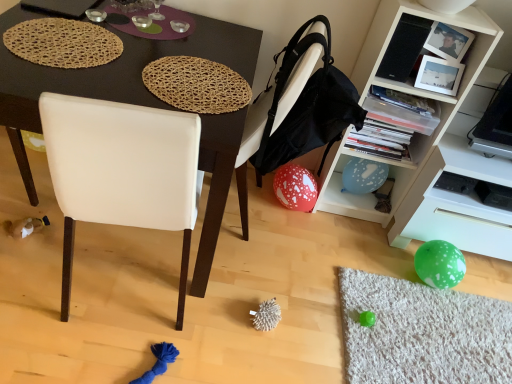
Identify the location of white matte cabinet at upper right. (408, 93).

This screenshot has width=512, height=384. What do you see at coordinates (456, 203) in the screenshot?
I see `white plastic shelf at lower right` at bounding box center [456, 203].

This screenshot has width=512, height=384. Identify the location of matte black desk at center. 110,73.

You are a GUI agent. You are given a task and a screenshot of the screen. Output one action in this format:
    pyautogui.click(x=<x>, y=<y>)
    Task: Click on the red dotted balloon at lower center
    This screenshot has height=384, width=512.
    Given the screenshot: What is the action you would take?
    pyautogui.click(x=295, y=187)

Locate an element on the screen. brown woven placemat at upper left, which appears as the 1th mat when viewed from the left is located at coordinates (63, 43).

The height and width of the screenshot is (384, 512). Describe the element at coordinates (270, 120) in the screenshot. I see `white leather chair at center` at that location.

Locate an element on the screen. white matte cabinet at upper right is located at coordinates (408, 93).

Is matte black desk at center beside white matte cabinet at upper right?

No, matte black desk at center is not beside white matte cabinet at upper right.

Does matte black desk at center turn towards white matte cabinet at upper right?

No, matte black desk at center is not oriented towards white matte cabinet at upper right.

Which object is positioned more to the left, matte black desk at center or white matte cabinet at upper right?

Positioned to the left is matte black desk at center.

What's the angular difference between matte black desk at center and white matte cabinet at upper right's facing directions?

matte black desk at center and white matte cabinet at upper right are facing 0.845 degrees away from each other.

Based on their sizes in the image, would you say matte black desk at center is bigger or smaller than brown woven placemat at upper left, which appears as the 1th mat when viewed from the left?

matte black desk at center is bigger than brown woven placemat at upper left, which appears as the 1th mat when viewed from the left.

From a real-world perspective, between matte black desk at center and brown woven placemat at upper left, arranged as the second mat when viewed from the right, who is vertically higher?

brown woven placemat at upper left, arranged as the second mat when viewed from the right, from a real-world perspective.

Which object is closer to the camera taking this photo, matte black desk at center or brown woven placemat at upper left, arranged as the second mat when viewed from the right?

matte black desk at center is more forward.

Would you say brown woven placemat at upper left, which appears as the 1th mat when viewed from the left, is part of matte black desk at center's contents?

Yes, matte black desk at center contains brown woven placemat at upper left, which appears as the 1th mat when viewed from the left.

In the image, is woven natural placemat at upper center, acting as the second mat starting from the left, positioned in front of or behind white plastic shelf at lower right?

woven natural placemat at upper center, acting as the second mat starting from the left, is positioned closer to the viewer than white plastic shelf at lower right.

Considering the sizes of objects woven natural placemat at upper center, acting as the second mat starting from the left, and white plastic shelf at lower right in the image provided, who is taller, woven natural placemat at upper center, acting as the second mat starting from the left, or white plastic shelf at lower right?

With more height is white plastic shelf at lower right.

Is woven natural placemat at upper center, acting as the second mat starting from the left, situated inside white plastic shelf at lower right or outside?

The correct answer is: outside.

At what (x,y) coordinates should I click in order to perform the action: click on the 1st mat above the white plastic shelf at lower right (from the image's perspective). Please return your answer as a coordinate pair (x, y). The height and width of the screenshot is (384, 512). Looking at the image, I should click on (196, 85).

Find the location of a particular element. The width and height of the screenshot is (512, 384). chair below the woven natural placemat at upper center, acting as the second mat starting from the left (from a real-world perspective) is located at coordinates (270, 120).

Is there a large distance between white leather chair at center and woven natural placemat at upper center, acting as the second mat starting from the left?

No, white leather chair at center is in close proximity to woven natural placemat at upper center, acting as the second mat starting from the left.

Is white leather chair at center situated inside woven natural placemat at upper center, acting as the second mat starting from the left, or outside?

white leather chair at center exists outside the volume of woven natural placemat at upper center, acting as the second mat starting from the left.

Which object is positioned more to the left, white leather chair at center or woven natural placemat at upper center, acting as the second mat starting from the left?

From the viewer's perspective, woven natural placemat at upper center, acting as the second mat starting from the left, appears more on the left side.

Does woven natural placemat at upper center, acting as the second mat starting from the left, have a greater width compared to white leather chair at center?

No, woven natural placemat at upper center, acting as the second mat starting from the left, is not wider than white leather chair at center.

Is woven natural placemat at upper center, the first mat when ordered from right to left, smaller than white leather chair at center?

Yes, woven natural placemat at upper center, the first mat when ordered from right to left, is smaller than white leather chair at center.

From a real-world perspective, is woven natural placemat at upper center, acting as the second mat starting from the left, below white leather chair at center?

Incorrect, from a real-world perspective, woven natural placemat at upper center, acting as the second mat starting from the left, is higher than white leather chair at center.

From their relative heights in the image, would you say brown woven placemat at upper left, arranged as the second mat when viewed from the right, is taller or shorter than white matte cabinet at upper right?

brown woven placemat at upper left, arranged as the second mat when viewed from the right, is shorter than white matte cabinet at upper right.

From a real-world perspective, is brown woven placemat at upper left, arranged as the second mat when viewed from the right, on top of white matte cabinet at upper right?

Yes.

Is point (75, 21) positioned after point (443, 18)?

No.

From the image's perspective, which is below, white plastic shelf at lower right or brown woven placemat at upper left, which appears as the 1th mat when viewed from the left?

white plastic shelf at lower right.

Can you confirm if white plastic shelf at lower right is bigger than brown woven placemat at upper left, arranged as the second mat when viewed from the right?

Yes.

Image resolution: width=512 pixels, height=384 pixels. In order to click on the 1st mat in front when counting from the white plastic shelf at lower right in this screenshot , I will do `click(63, 43)`.

Image resolution: width=512 pixels, height=384 pixels. Identify the location of desk below the white matte cabinet at upper right (from the image's perspective). (110, 73).

I want to click on desk below the brown woven placemat at upper left, arranged as the second mat when viewed from the right (from a real-world perspective), so click(110, 73).

Based on their spatial positions, is white matte cabinet at upper right or woven natural placemat at upper center, acting as the second mat starting from the left, closer to white plastic shelf at lower right?

Among the two, white matte cabinet at upper right is located nearer to white plastic shelf at lower right.

Based on their spatial positions, is red dotted balloon at lower center or white plastic shelf at lower right closer to white matte cabinet at upper right?

white plastic shelf at lower right lies closer to white matte cabinet at upper right than the other object.

Based on the photo, which object lies further to the anchor point red dotted balloon at lower center, brown woven placemat at upper left, which appears as the 1th mat when viewed from the left, or white matte cabinet at upper right?

Based on the image, brown woven placemat at upper left, which appears as the 1th mat when viewed from the left, appears to be further to red dotted balloon at lower center.

When comparing their distances from matte black desk at center, does white leather chair at center or brown woven placemat at upper left, which appears as the 1th mat when viewed from the left, seem further?

white leather chair at center.

Which object lies nearer to the anchor point white plastic shelf at lower right, brown woven placemat at upper left, arranged as the second mat when viewed from the right, or matte black desk at center?

matte black desk at center lies closer to white plastic shelf at lower right than the other object.

When comparing their distances from woven natural placemat at upper center, the first mat when ordered from right to left, does white matte cabinet at upper right or matte black desk at center seem closer?

matte black desk at center.

Which object lies further to the anchor point red dotted balloon at lower center, white leather chair at center or matte black desk at center?

matte black desk at center lies further to red dotted balloon at lower center than the other object.

When comparing their distances from brown woven placemat at upper left, which appears as the 1th mat when viewed from the left, does white plastic shelf at lower right or white matte cabinet at upper right seem closer?

white matte cabinet at upper right is closer to brown woven placemat at upper left, which appears as the 1th mat when viewed from the left.

This screenshot has height=384, width=512. I want to click on desk situated between brown woven placemat at upper left, arranged as the second mat when viewed from the right, and red dotted balloon at lower center from left to right, so click(110, 73).

Find the location of a particular element. This screenshot has width=512, height=384. chair between woven natural placemat at upper center, the first mat when ordered from right to left, and white plastic shelf at lower right is located at coordinates 270,120.

This screenshot has height=384, width=512. What are the coordinates of `mat between matte black desk at center and white plastic shelf at lower right in the horizontal direction` in the screenshot? It's located at (196, 85).

At what (x,y) coordinates should I click in order to perform the action: click on mat between brown woven placemat at upper left, which appears as the 1th mat when viewed from the left, and white leather chair at center from left to right. Please return your answer as a coordinate pair (x, y). The image size is (512, 384). Looking at the image, I should click on [196, 85].